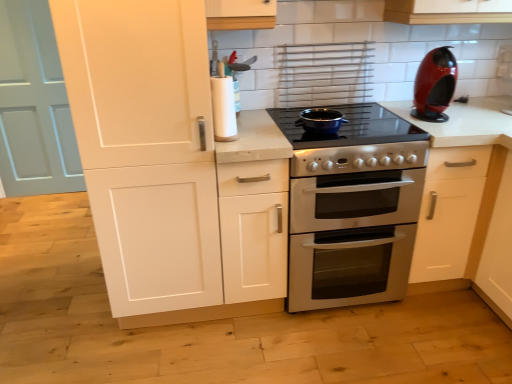
Question: Would you say light blue wood door at left is inside or outside glossy plastic coffee machine at upper right?

Choices:
 (A) outside
 (B) inside

Answer: (A)

Question: Is light blue wood door at left to the left or to the right of glossy plastic coffee machine at upper right in the image?

Choices:
 (A) right
 (B) left

Answer: (B)

Question: Which object is the farthest from the smooth white countertop at center?

Choices:
 (A) glossy plastic coffee machine at upper right
 (B) light blue wood door at left
 (C) matte black pot at center
 (D) white matte cabinet at left

Answer: (B)

Question: Estimate the real-world distances between objects in this image. Which object is closer to the white matte cabinet at left?

Choices:
 (A) smooth white countertop at center
 (B) glossy plastic coffee machine at upper right
 (C) matte black pot at center
 (D) light blue wood door at left

Answer: (C)